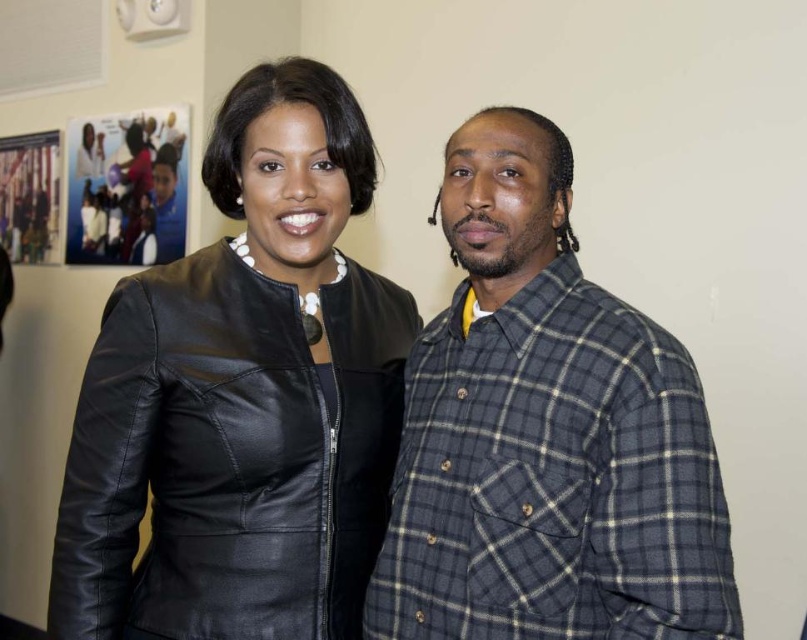
Does black leather jacket at center appear under plaid flannel shirt at right?

Incorrect, black leather jacket at center is not positioned below plaid flannel shirt at right.

Where is `black leather jacket at center`? black leather jacket at center is located at coordinates (241, 397).